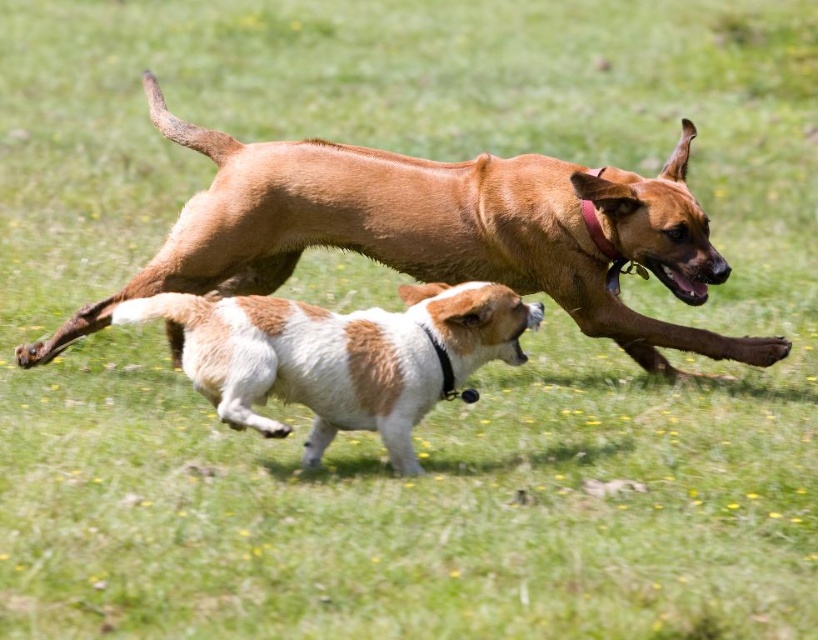
Question: Which object appears closest to the camera in this image?

Choices:
 (A) brown smooth dog at center
 (B) white-brown fur dog at center

Answer: (B)

Question: Can you confirm if brown smooth dog at center is positioned below white-brown fur dog at center?

Choices:
 (A) yes
 (B) no

Answer: (B)

Question: Which of the following is the farthest from the observer?

Choices:
 (A) (335, 406)
 (B) (178, 237)

Answer: (B)

Question: Is brown smooth dog at center smaller than white-brown fur dog at center?

Choices:
 (A) no
 (B) yes

Answer: (A)

Question: Is brown smooth dog at center smaller than white-brown fur dog at center?

Choices:
 (A) no
 (B) yes

Answer: (A)

Question: Which object appears farthest from the camera in this image?

Choices:
 (A) brown smooth dog at center
 (B) white-brown fur dog at center

Answer: (A)